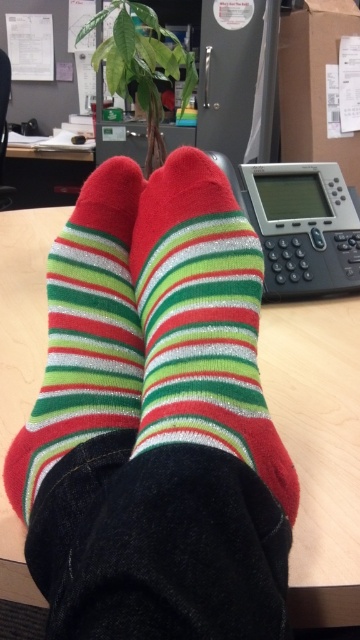
You are standing at the origin of the coordinate system in the image. You see two points, point [317,406] and point [106,260]. Which point is further away from you?

Point [317,406] is further away from you than point [106,260].

You are trying to locate the wooden table at center in the image. According to the coordinates provided, where would you find it?

The wooden table at center is located at point coordinates of [318,449].